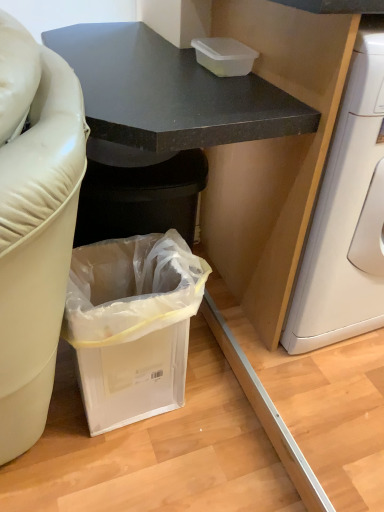
Question: Is matte black cabinet at lower left bigger than transparent plastic container at upper center?

Choices:
 (A) no
 (B) yes

Answer: (B)

Question: Is matte black cabinet at lower left at the left side of transparent plastic container at upper center?

Choices:
 (A) yes
 (B) no

Answer: (A)

Question: From a real-world perspective, is matte black cabinet at lower left physically below transparent plastic container at upper center?

Choices:
 (A) no
 (B) yes

Answer: (B)

Question: From the image's perspective, is matte black cabinet at lower left located beneath transparent plastic container at upper center?

Choices:
 (A) no
 (B) yes

Answer: (B)

Question: Considering the relative positions of matte black cabinet at lower left and transparent plastic container at upper center in the image provided, is matte black cabinet at lower left in front of transparent plastic container at upper center?

Choices:
 (A) yes
 (B) no

Answer: (A)

Question: Can you confirm if matte black cabinet at lower left is shorter than transparent plastic container at upper center?

Choices:
 (A) no
 (B) yes

Answer: (A)

Question: Does transparent plastic container at upper center have a smaller size compared to clear plastic trash can at lower left?

Choices:
 (A) no
 (B) yes

Answer: (B)

Question: Are transparent plastic container at upper center and clear plastic trash can at lower left located far from each other?

Choices:
 (A) yes
 (B) no

Answer: (B)

Question: Is transparent plastic container at upper center placed right next to clear plastic trash can at lower left?

Choices:
 (A) no
 (B) yes

Answer: (A)

Question: Does transparent plastic container at upper center have a greater height compared to clear plastic trash can at lower left?

Choices:
 (A) no
 (B) yes

Answer: (A)

Question: Is transparent plastic container at upper center oriented towards clear plastic trash can at lower left?

Choices:
 (A) yes
 (B) no

Answer: (B)

Question: Can you confirm if transparent plastic container at upper center is positioned to the right of clear plastic trash can at lower left?

Choices:
 (A) yes
 (B) no

Answer: (A)

Question: Is there a large distance between clear plastic trash can at lower left and matte black cabinet at lower left?

Choices:
 (A) no
 (B) yes

Answer: (A)